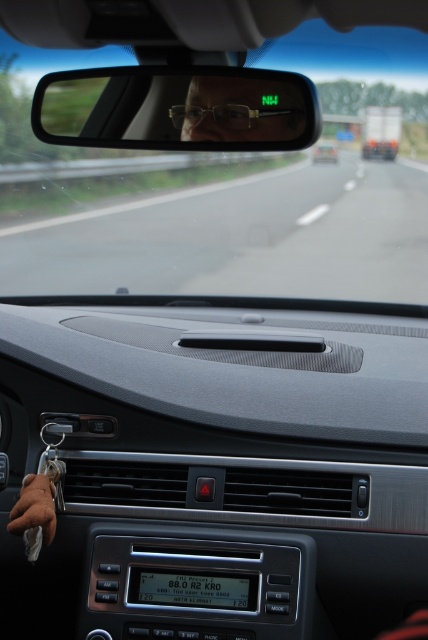
You are sitting in the driver seat of the car. You want to reach the point marked as point (x=38, y=243). Can you comfortably reach it without moving your seat?

The distance between you and point (x=38, y=243) is 10.97 meters, which is too far to reach comfortably without moving your seat.

You are sitting in the driver seat of the car shown in the image. You want to reach the point marked as point (312, 120). Can you reach it without leaving the driver seat?

The point (312, 120) is 7.33 feet away from the camera, so it is too far to reach from the driver seat without leaving the seat.

You are a delivery robot with a height of 1.5 meters. You need to pass through the space between the transparent glass windshield at upper center and the matte black glasses at center. Can you fit through vertically?

The distance between the transparent glass windshield at upper center and the matte black glasses at center is 4.47 meters, which is taller than the robot height of 1.5 meters. The robot can fit through vertically.